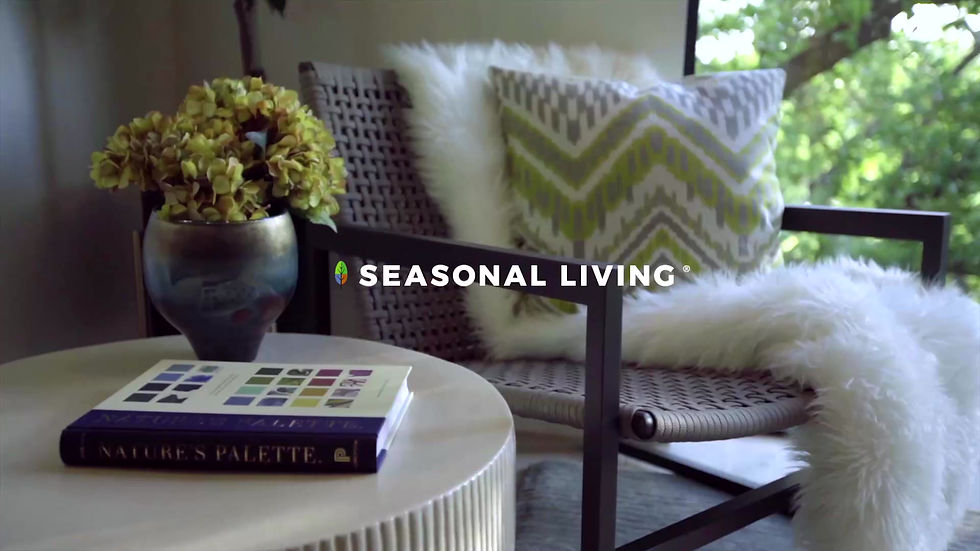
Where is `floor`? The width and height of the screenshot is (980, 551). floor is located at coordinates (570, 507).